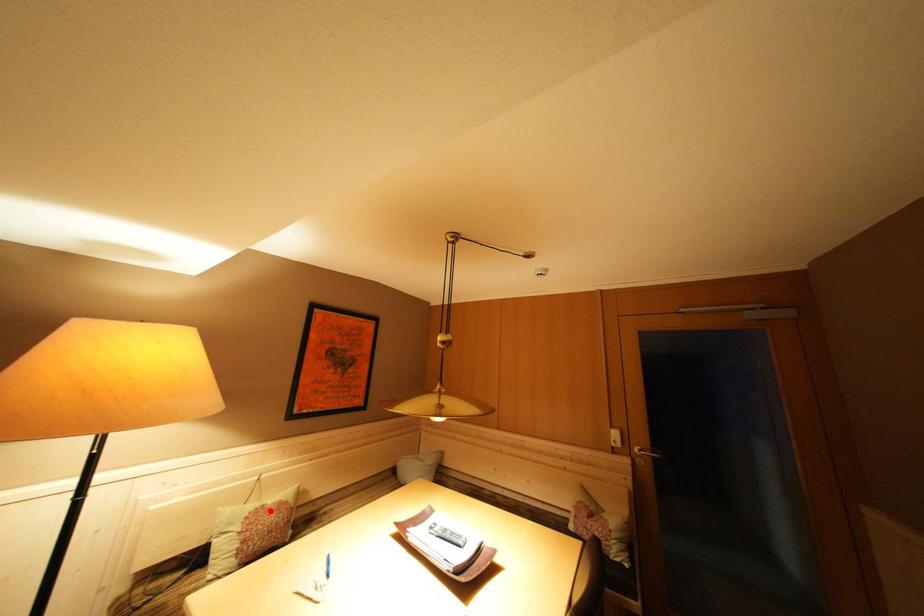
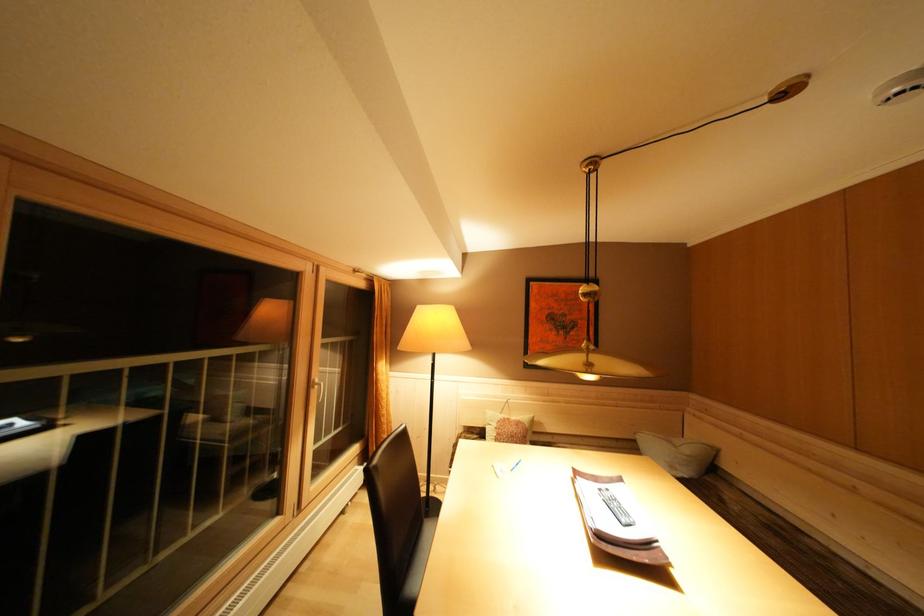
Question: I am providing you with two images of the same scene from different viewpoints. In image1, a red point is highlighted. Considering the same 3D point in image2, which of the following is correct?

Choices:
 (A) It is closer
 (B) It is farther

Answer: (B)